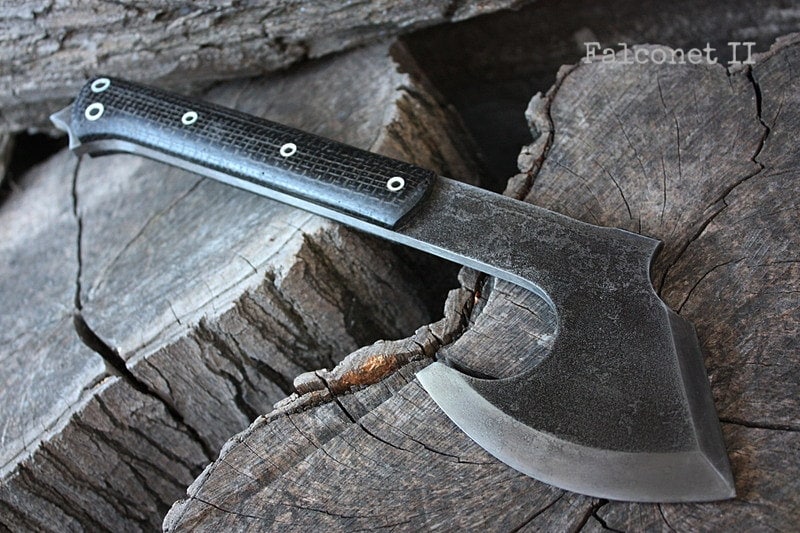
At what (x,y) coordinates should I click in order to perform the action: click on handle. Please return your answer as a coordinate pair (x, y). Looking at the image, I should click on (245, 143).